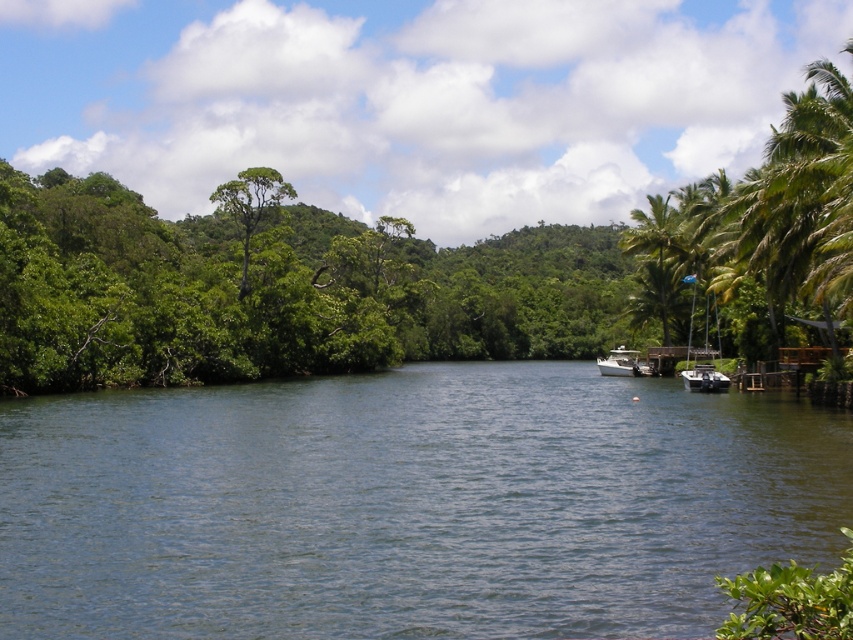
Question: Is green leafy tree at right to the left of green leafy palm tree at right from the viewer's perspective?

Choices:
 (A) no
 (B) yes

Answer: (B)

Question: Can you confirm if green leafy tree at right is wider than metallic silver boat at right?

Choices:
 (A) yes
 (B) no

Answer: (A)

Question: Where is blue water at center located in relation to metallic silver boat at right in the image?

Choices:
 (A) right
 (B) left

Answer: (B)

Question: Which point is closer to the camera?

Choices:
 (A) green leafy tree at right
 (B) metallic silver boat at right

Answer: (A)

Question: Which point appears farthest from the camera in this image?

Choices:
 (A) (637, 353)
 (B) (486, 493)
 (C) (669, 232)

Answer: (A)

Question: Which point is closer to the camera taking this photo?

Choices:
 (A) (665, 218)
 (B) (718, 372)

Answer: (B)